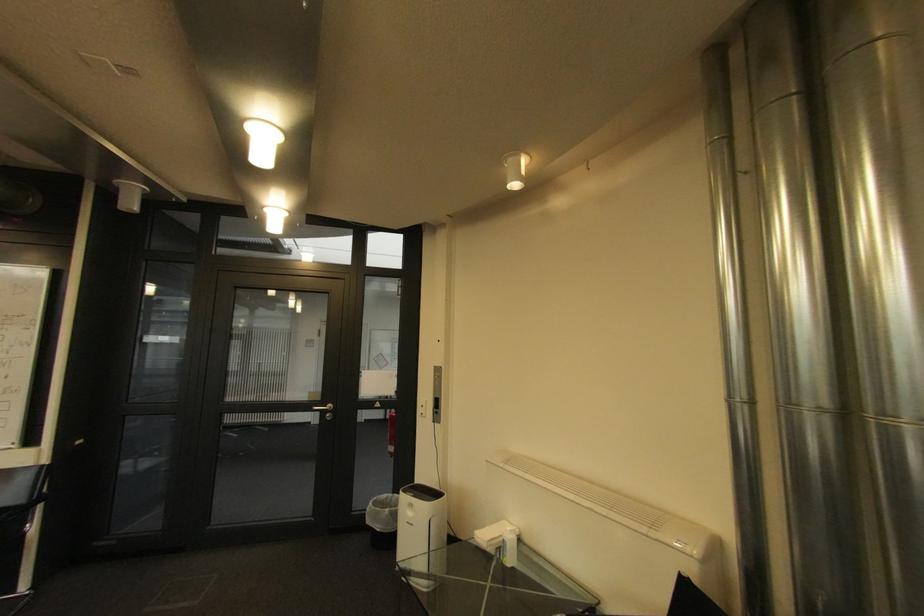
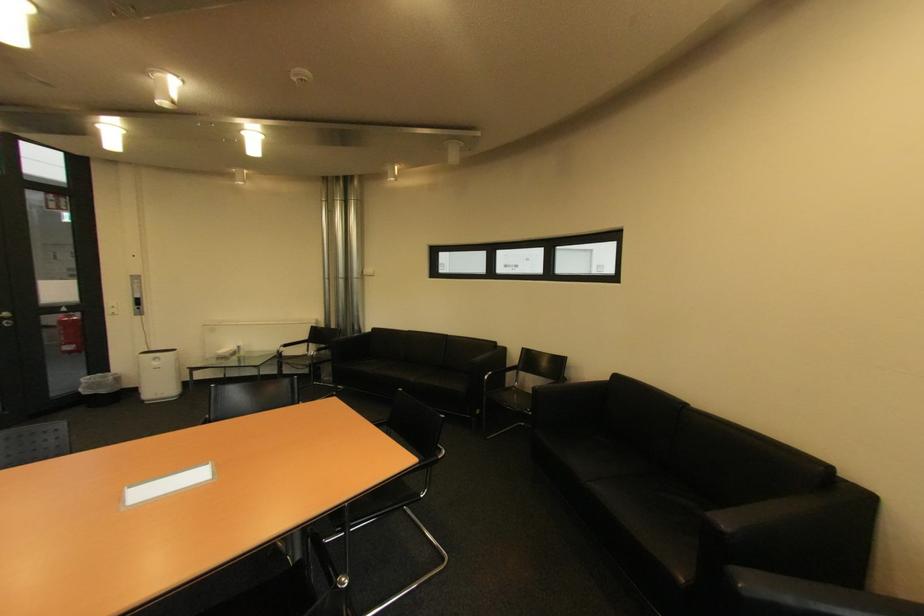
In the second image, find the point that corresponds to the point at 399,450 in the first image.

(79, 349)